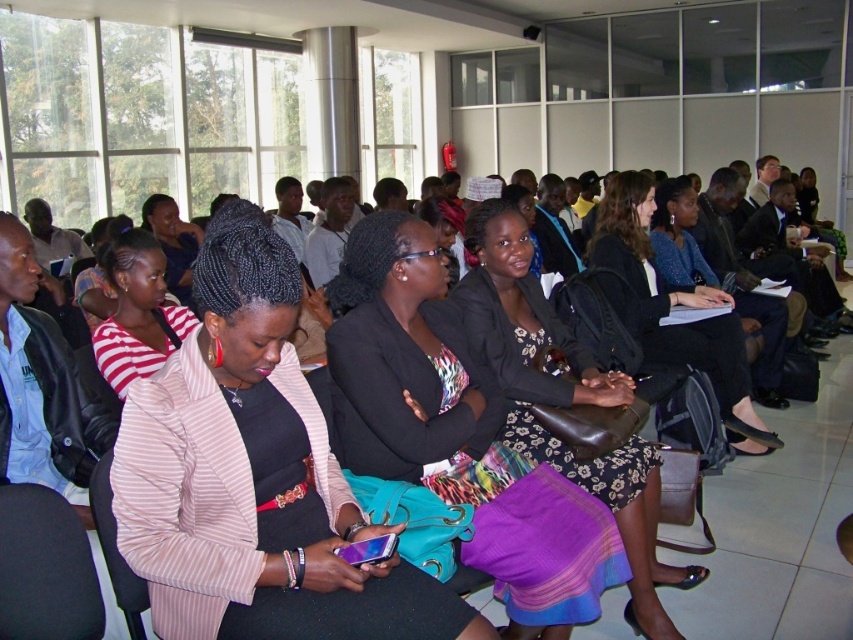
Question: Estimate the real-world distances between objects in this image. Which object is closer to the floral-patterned dress at center?

Choices:
 (A) striped fabric jacket at center
 (B) matte black blazer at center

Answer: (B)

Question: Which of these objects is positioned farthest from the striped fabric jacket at center?

Choices:
 (A) striped fabric shirt at left
 (B) floral-patterned dress at center

Answer: (A)

Question: Which point appears closest to the camera in this image?

Choices:
 (A) (628, 586)
 (B) (157, 323)
 (C) (210, 412)

Answer: (C)

Question: Is the position of striped fabric jacket at center more distant than that of black leather jacket at center?

Choices:
 (A) yes
 (B) no

Answer: (B)

Question: From the image, what is the correct spatial relationship of floral-patterned dress at center in relation to striped fabric shirt at left?

Choices:
 (A) above
 (B) below

Answer: (B)

Question: Can you confirm if striped fabric jacket at center is smaller than black leather jacket at center?

Choices:
 (A) no
 (B) yes

Answer: (B)